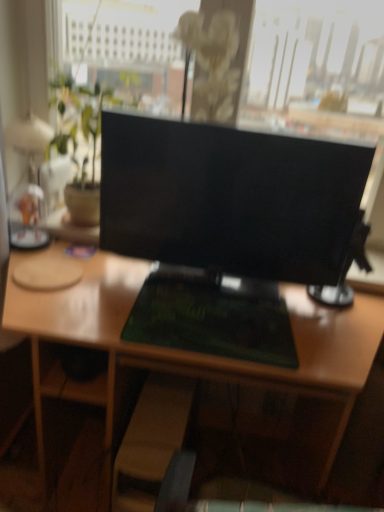
Image resolution: width=384 pixels, height=512 pixels. I want to click on vacant space situated above green matte desk at center (from a real-world perspective), so click(196, 296).